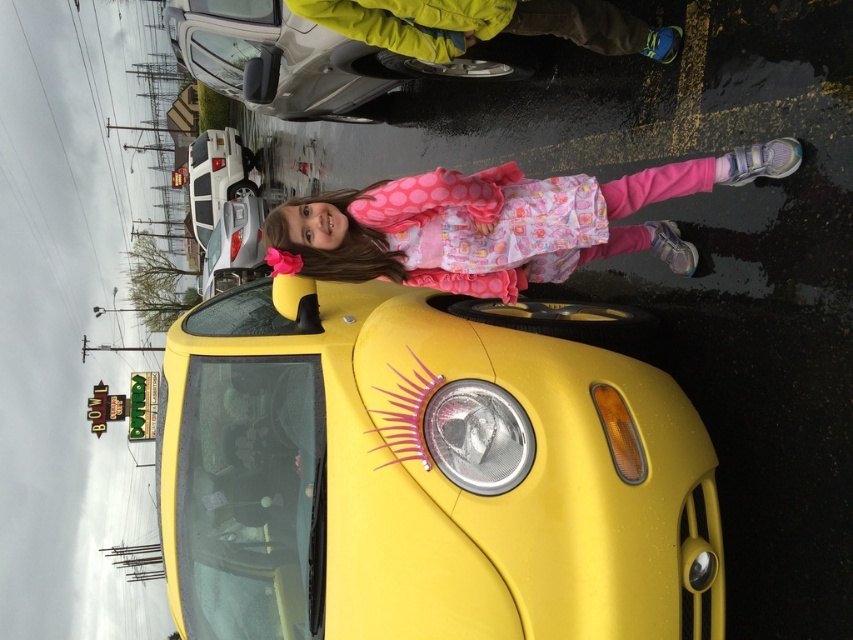
Question: Can you confirm if metallic silver car at upper center is thinner than metallic silver headlight at center?

Choices:
 (A) yes
 (B) no

Answer: (B)

Question: Which object is positioned closest to the metallic silver car at upper left?

Choices:
 (A) metallic silver headlight at center
 (B) yellow shiny car at center
 (C) pink polka dot dress at center
 (D) yellow fabric jacket at upper center

Answer: (D)

Question: Which object is the closest to the metallic silver car at upper center?

Choices:
 (A) pink polka dot dress at center
 (B) white glossy suv at upper left
 (C) metallic silver headlight at center
 (D) metallic silver car at upper left

Answer: (D)

Question: Which point appears closest to the camera in this image?

Choices:
 (A) (422, 72)
 (B) (213, 225)
 (C) (409, 560)
 (D) (253, 154)

Answer: (C)

Question: Does yellow shiny car at center appear under white glossy suv at upper left?

Choices:
 (A) yes
 (B) no

Answer: (A)

Question: Is yellow shiny car at center smaller than yellow fabric jacket at upper center?

Choices:
 (A) no
 (B) yes

Answer: (A)